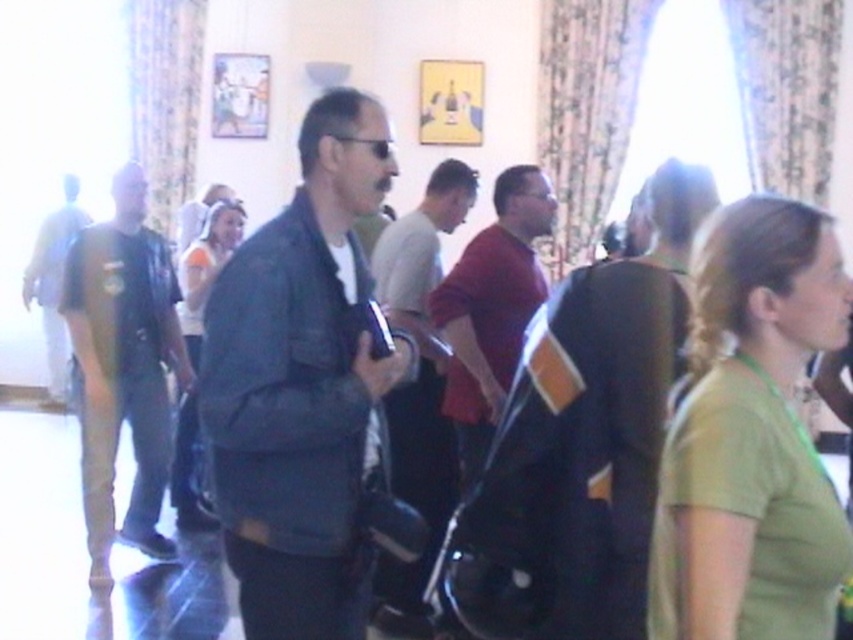
You are standing in the room and want to move from point A to point B. Point A is at coordinates point (379,193) and point B is at coordinates point (497,433). Which point is closer to you?

Point (379,193) is closer to the viewer than point (497,433), so point A is closer to you.